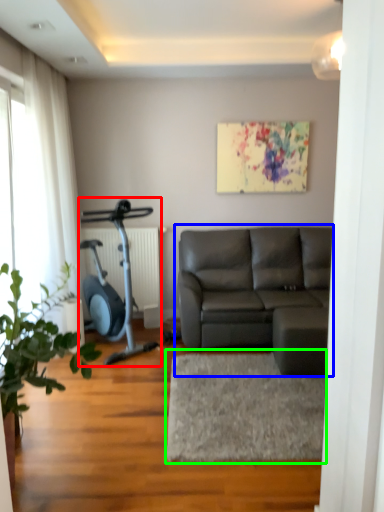
Question: Which object is the farthest from stationary bicycle (highlighted by a red box)? Choose among these: studio couch (highlighted by a blue box) or flat (highlighted by a green box).

Choices:
 (A) studio couch
 (B) flat

Answer: (B)